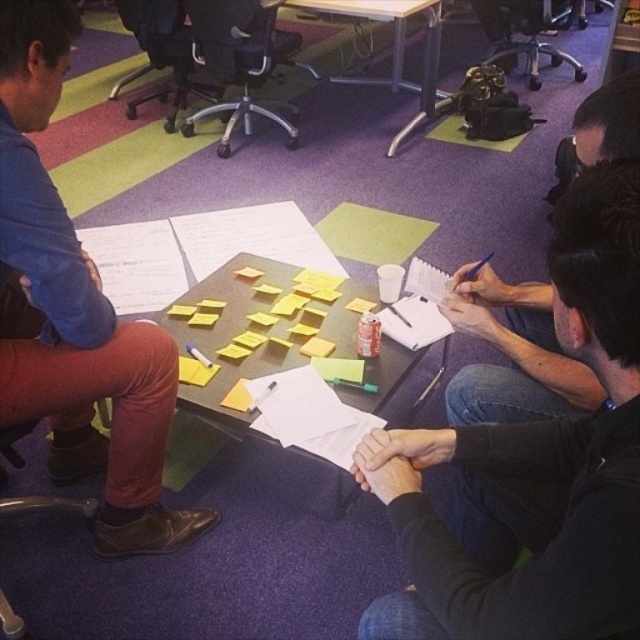
What are the coordinates of the matte blue shirt at left in the image?

The coordinates of the matte blue shirt at left are at point (76,312).

You are an office assistant who needs to place a new item on the table where the black matte shirt at center and yellow sticky notes at center are located. Considering their positions, which object is taller and should be avoided to prevent blocking the view of the other?

The black matte shirt at center is taller than the yellow sticky notes at center, so placing the new item near the black matte shirt at center might block the view of the yellow sticky notes at center.